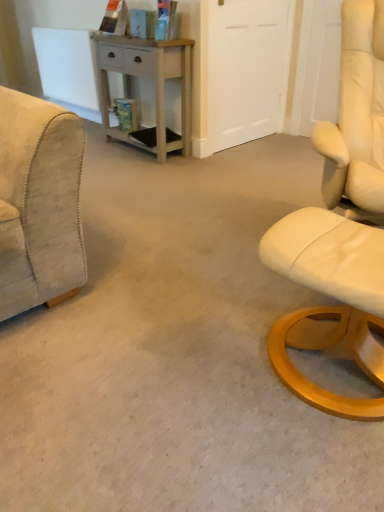
Question: Considering the relative sizes of light gray wood desk at center and white matte door at upper center in the image provided, is light gray wood desk at center bigger than white matte door at upper center?

Choices:
 (A) yes
 (B) no

Answer: (A)

Question: Considering the relative sizes of light gray wood desk at center and white matte door at upper center in the image provided, is light gray wood desk at center wider than white matte door at upper center?

Choices:
 (A) yes
 (B) no

Answer: (A)

Question: Does light gray wood desk at center turn towards white matte door at upper center?

Choices:
 (A) no
 (B) yes

Answer: (A)

Question: Could white matte door at upper center be considered to be inside light gray wood desk at center?

Choices:
 (A) no
 (B) yes

Answer: (A)

Question: From the image's perspective, is light gray wood desk at center over white matte door at upper center?

Choices:
 (A) yes
 (B) no

Answer: (B)

Question: Can you confirm if light gray wood desk at center is smaller than white matte door at upper center?

Choices:
 (A) no
 (B) yes

Answer: (A)

Question: Is white matte door at upper center taller than beige corduroy armchair at left?

Choices:
 (A) yes
 (B) no

Answer: (A)

Question: Is white matte door at upper center surrounding beige corduroy armchair at left?

Choices:
 (A) yes
 (B) no

Answer: (B)

Question: Is white matte door at upper center in contact with beige corduroy armchair at left?

Choices:
 (A) no
 (B) yes

Answer: (A)

Question: Is white matte door at upper center wider than beige corduroy armchair at left?

Choices:
 (A) yes
 (B) no

Answer: (B)

Question: Does white matte door at upper center appear on the left side of beige corduroy armchair at left?

Choices:
 (A) no
 (B) yes

Answer: (A)

Question: Is white matte door at upper center behind beige corduroy armchair at left?

Choices:
 (A) no
 (B) yes

Answer: (B)

Question: Is light gray wood desk at center looking in the opposite direction of beige corduroy armchair at left?

Choices:
 (A) no
 (B) yes

Answer: (A)